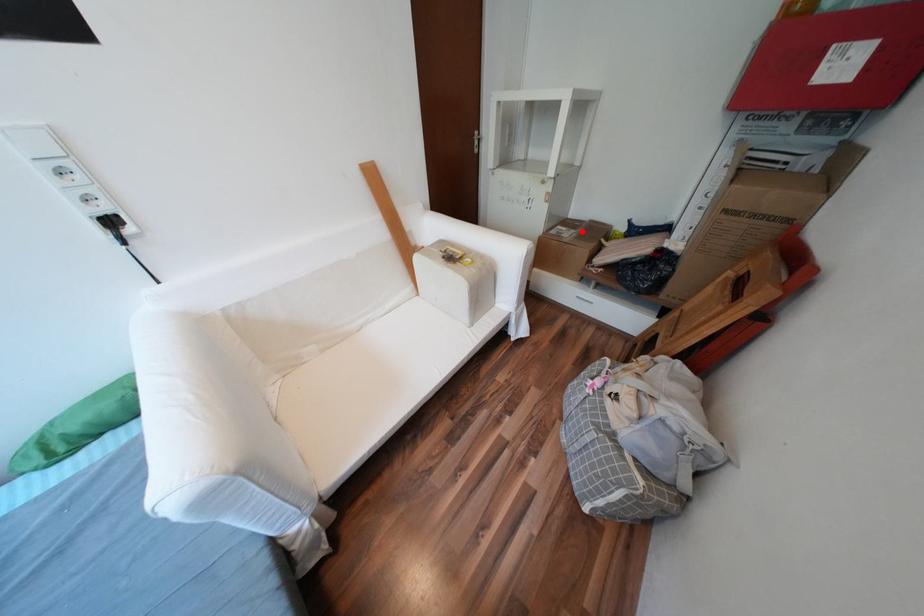
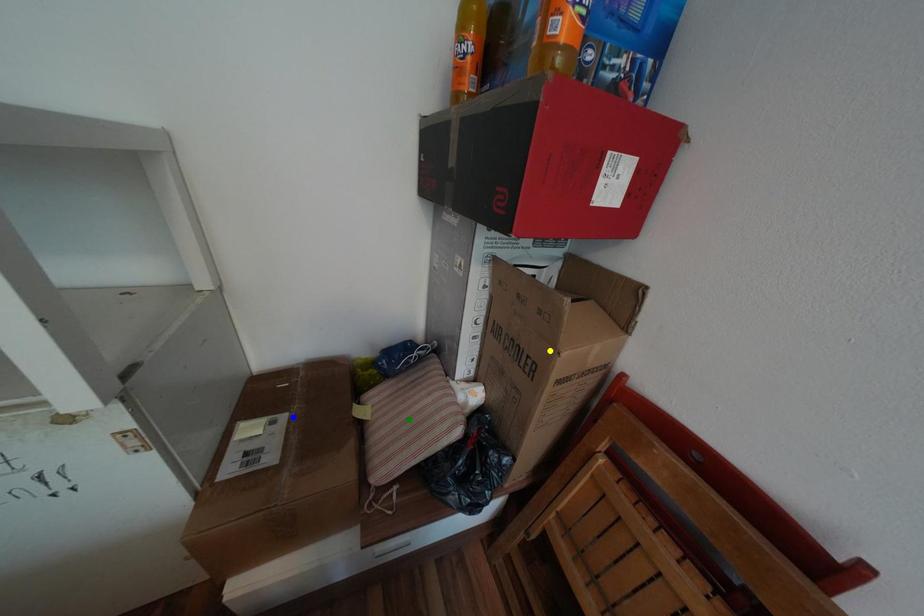
Question: I am providing you with two images of the same scene from different viewpoints. A red point is marked on the first image. You are given multiple points on the second image. Which point in image 2 represents the same 3d spot as the red point in image 1?

Choices:
 (A) yellow point
 (B) green point
 (C) blue point

Answer: (C)